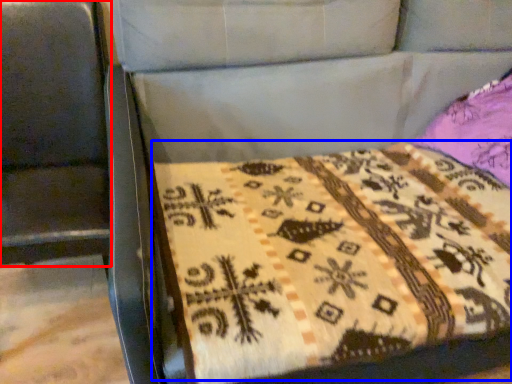
Question: Which of the following is the closest to the observer, swivel chair (highlighted by a red box) or quilt (highlighted by a blue box)?

Choices:
 (A) swivel chair
 (B) quilt

Answer: (A)